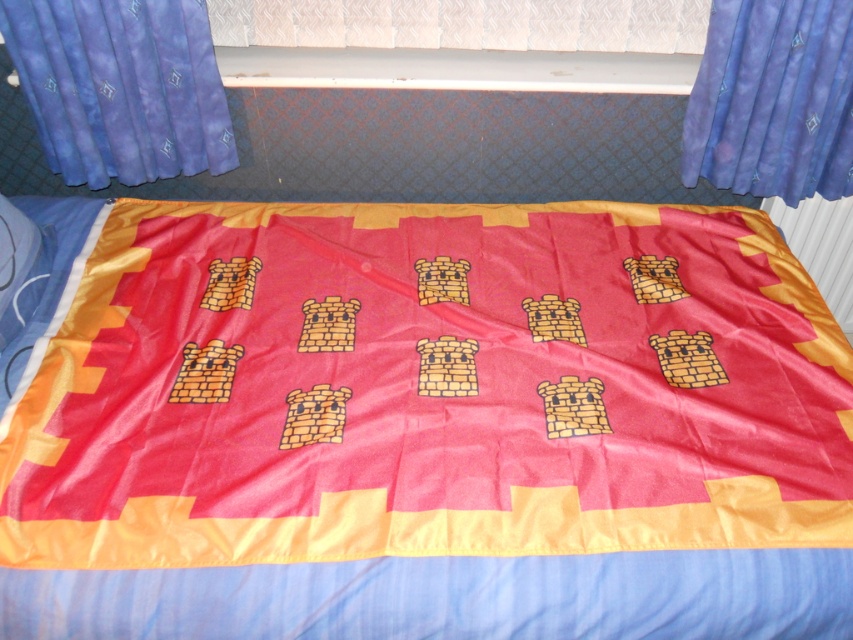
In the scene shown: You are standing in the room and want to know which curtain is wider. Can you tell me which one is wider between the blue fabric curtain at upper left and the blue satin curtain at upper right?

The blue fabric curtain at upper left is wider than the blue satin curtain at upper right.

You are standing at the center of the room and want to place a new decorative pillow exactly where the satin red quilt at center is located. What coordinates should you aim for?

You should aim for coordinates point at point (x=422, y=426) where the satin red quilt at center is located.